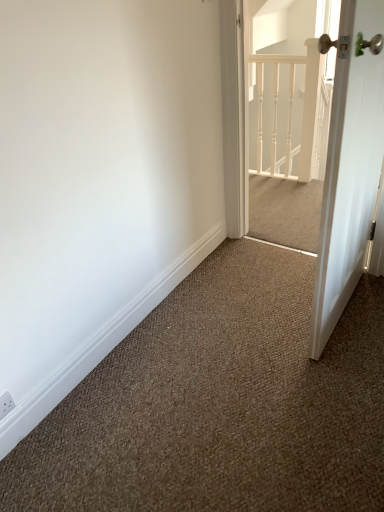
Question: Does white painted wood railing at upper center turn towards white glossy door at right?

Choices:
 (A) yes
 (B) no

Answer: (B)

Question: Is white painted wood railing at upper center thinner than white glossy door at right?

Choices:
 (A) yes
 (B) no

Answer: (A)

Question: Does white painted wood railing at upper center have a greater width compared to white glossy door at right?

Choices:
 (A) no
 (B) yes

Answer: (A)

Question: From the image's perspective, is white painted wood railing at upper center below white glossy door at right?

Choices:
 (A) no
 (B) yes

Answer: (A)

Question: Is there a large distance between white painted wood railing at upper center and white glossy door at right?

Choices:
 (A) no
 (B) yes

Answer: (B)

Question: Considering the positions of white glossy door at right and white painted wood railing at upper center in the image, is white glossy door at right wider or thinner than white painted wood railing at upper center?

Choices:
 (A) thin
 (B) wide

Answer: (B)

Question: Is white glossy door at right inside or outside of white painted wood railing at upper center?

Choices:
 (A) outside
 (B) inside

Answer: (A)

Question: Is point (349, 44) closer or farther from the camera than point (291, 99)?

Choices:
 (A) farther
 (B) closer

Answer: (B)

Question: Based on their positions, is white glossy door at right located to the left or right of white painted wood railing at upper center?

Choices:
 (A) left
 (B) right

Answer: (B)

Question: Relative to white painted wood railing at upper center, is white textured screen door at upper right in front or behind?

Choices:
 (A) behind
 (B) front

Answer: (B)

Question: In terms of width, does white textured screen door at upper right look wider or thinner when compared to white painted wood railing at upper center?

Choices:
 (A) wide
 (B) thin

Answer: (A)

Question: Is white textured screen door at upper right taller or shorter than white painted wood railing at upper center?

Choices:
 (A) tall
 (B) short

Answer: (A)

Question: Is point (286, 144) positioned closer to the camera than point (314, 158)?

Choices:
 (A) closer
 (B) farther

Answer: (A)

Question: From a real-world perspective, is white glossy door at right above or below white textured screen door at upper right?

Choices:
 (A) above
 (B) below

Answer: (A)

Question: Looking at their shapes, would you say white glossy door at right is wider or thinner than white textured screen door at upper right?

Choices:
 (A) wide
 (B) thin

Answer: (B)